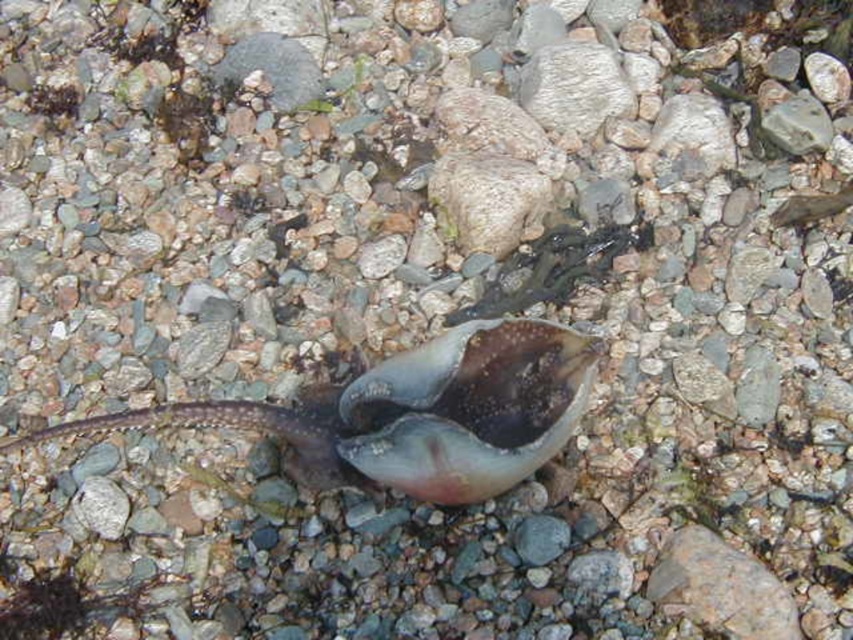
Is translucent rubber snail at center above smooth gray rock at center?

No.

Who is positioned more to the right, translucent rubber snail at center or smooth gray rock at center?

translucent rubber snail at center is more to the right.

Between point (260, 419) and point (280, 77), which one is positioned behind?

The point (280, 77) is behind.

I want to click on translucent rubber snail at center, so click(x=418, y=412).